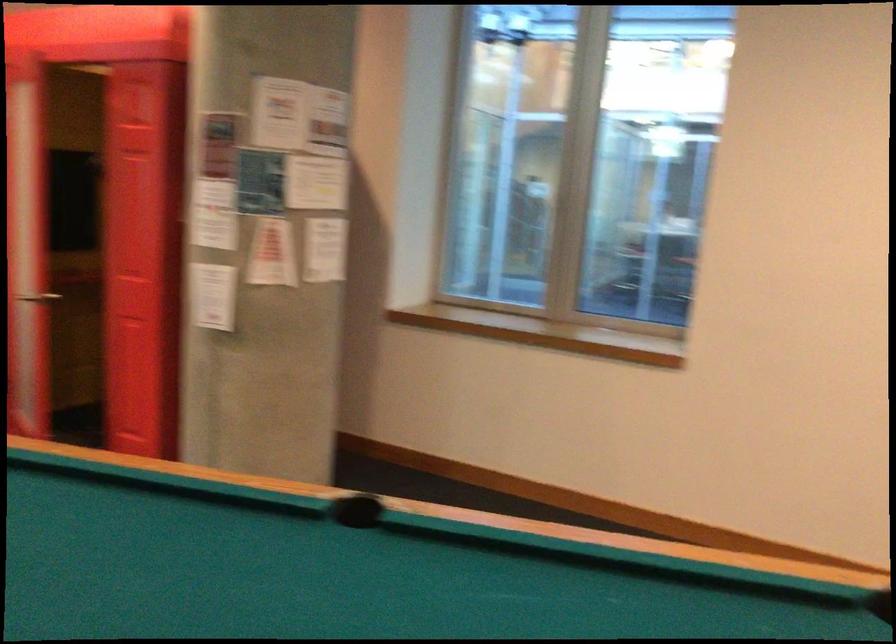
What do you see at coordinates (38, 297) in the screenshot?
I see `the silver door handle` at bounding box center [38, 297].